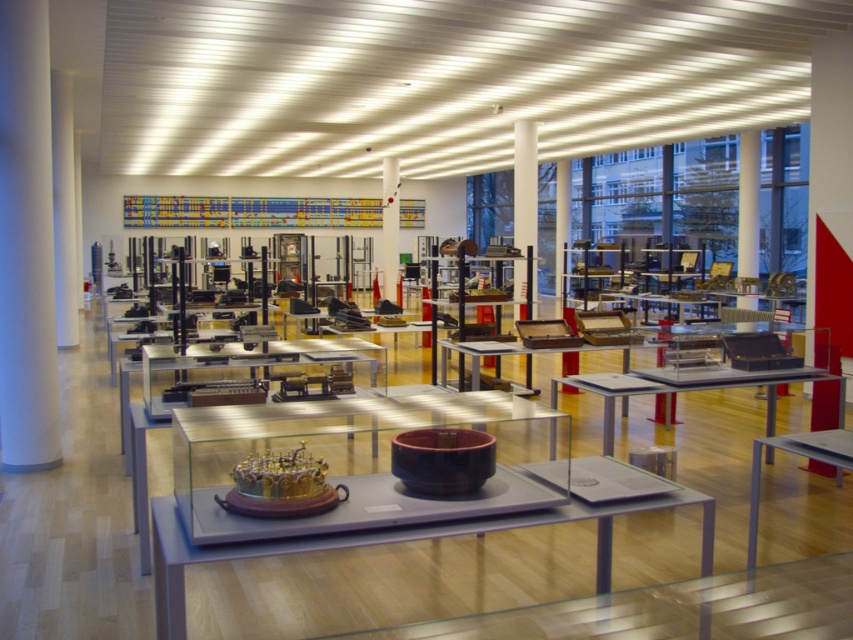
Question: Can you confirm if metallic silver table at center is smaller than wooden table at center?

Choices:
 (A) no
 (B) yes

Answer: (A)

Question: Can you confirm if matte gray table at center is positioned to the left of white glossy pillar at center?

Choices:
 (A) no
 (B) yes

Answer: (A)

Question: Which point is farther to the camera?

Choices:
 (A) (395, 220)
 (B) (622, 396)
 (C) (196, 563)
 (D) (463, 342)

Answer: (A)

Question: Does matte gray table at center have a larger size compared to wooden table at center?

Choices:
 (A) yes
 (B) no

Answer: (A)

Question: Which point is farther from the camera taking this photo?

Choices:
 (A) (636, 376)
 (B) (497, 342)
 (C) (601, 577)
 (D) (200, 460)

Answer: (B)

Question: Which of the following is the closest to the observer?

Choices:
 (A) (196, 449)
 (B) (447, 340)
 (C) (531, 516)
 (D) (759, 378)

Answer: (C)